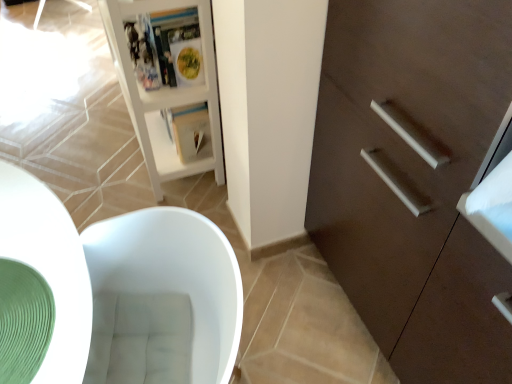
Question: Which direction should I rotate to face white paper magazine at center, which ranks as the 1th magazine in back-to-front order, — up or down?

Choices:
 (A) down
 (B) up

Answer: (B)

Question: Considering the relative sizes of dark brown wood cabinet at right and white paper magazine at center, which ranks as the 1th magazine in back-to-front order, in the image provided, is dark brown wood cabinet at right wider than white paper magazine at center, which ranks as the 1th magazine in back-to-front order,?

Choices:
 (A) yes
 (B) no

Answer: (A)

Question: Is dark brown wood cabinet at right not close to white paper magazine at center, which ranks as the 1th magazine in back-to-front order?

Choices:
 (A) no
 (B) yes

Answer: (A)

Question: From the image's perspective, does dark brown wood cabinet at right appear lower than white paper magazine at center, the second magazine positioned from the front?

Choices:
 (A) yes
 (B) no

Answer: (A)

Question: Considering the relative positions of dark brown wood cabinet at right and white paper magazine at center, which ranks as the 1th magazine in back-to-front order, in the image provided, is dark brown wood cabinet at right in front of white paper magazine at center, which ranks as the 1th magazine in back-to-front order,?

Choices:
 (A) no
 (B) yes

Answer: (B)

Question: Can we say dark brown wood cabinet at right lies outside white paper magazine at center, the second magazine positioned from the front?

Choices:
 (A) no
 (B) yes

Answer: (B)

Question: From a real-world perspective, is dark brown wood cabinet at right positioned under white paper magazine at center, which ranks as the 1th magazine in back-to-front order, based on gravity?

Choices:
 (A) no
 (B) yes

Answer: (A)

Question: From the image's perspective, is white paper magazine at center, the second magazine positioned from the front, on top of green rubber mat at lower left?

Choices:
 (A) yes
 (B) no

Answer: (A)

Question: Can you confirm if white paper magazine at center, the second magazine positioned from the front, is wider than green rubber mat at lower left?

Choices:
 (A) yes
 (B) no

Answer: (B)

Question: From the image's perspective, does white paper magazine at center, the second magazine positioned from the front, appear lower than green rubber mat at lower left?

Choices:
 (A) yes
 (B) no

Answer: (B)

Question: Is white paper magazine at center, the second magazine positioned from the front, far from green rubber mat at lower left?

Choices:
 (A) yes
 (B) no

Answer: (B)

Question: Is white paper magazine at center, the second magazine positioned from the front, to the right of green rubber mat at lower left from the viewer's perspective?

Choices:
 (A) yes
 (B) no

Answer: (A)

Question: Is white paper magazine at center, the second magazine positioned from the front, at the left side of green rubber mat at lower left?

Choices:
 (A) no
 (B) yes

Answer: (A)

Question: Is dark brown wood cabinet at right in contact with matte plastic magazine at upper center, which is the 1th magazine from front to back?

Choices:
 (A) no
 (B) yes

Answer: (A)